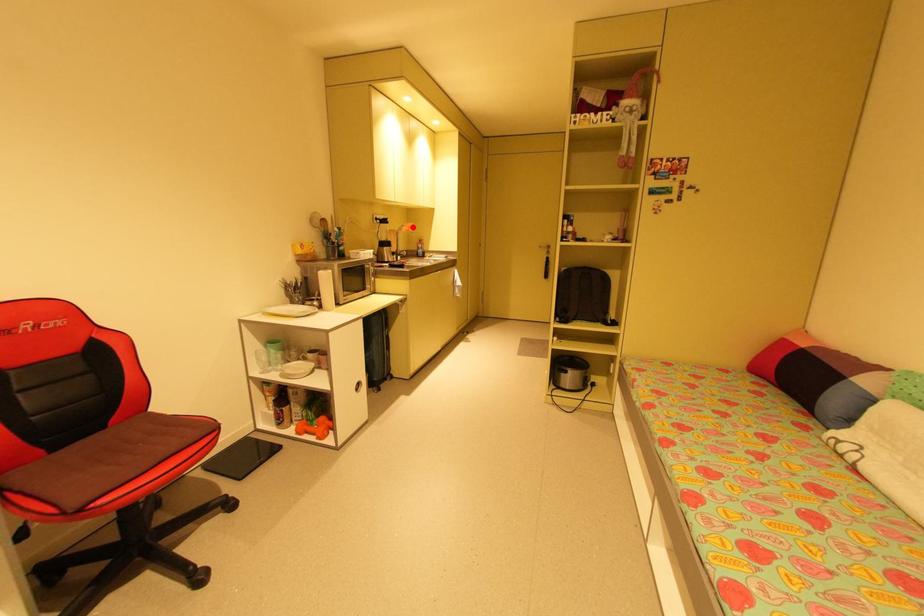
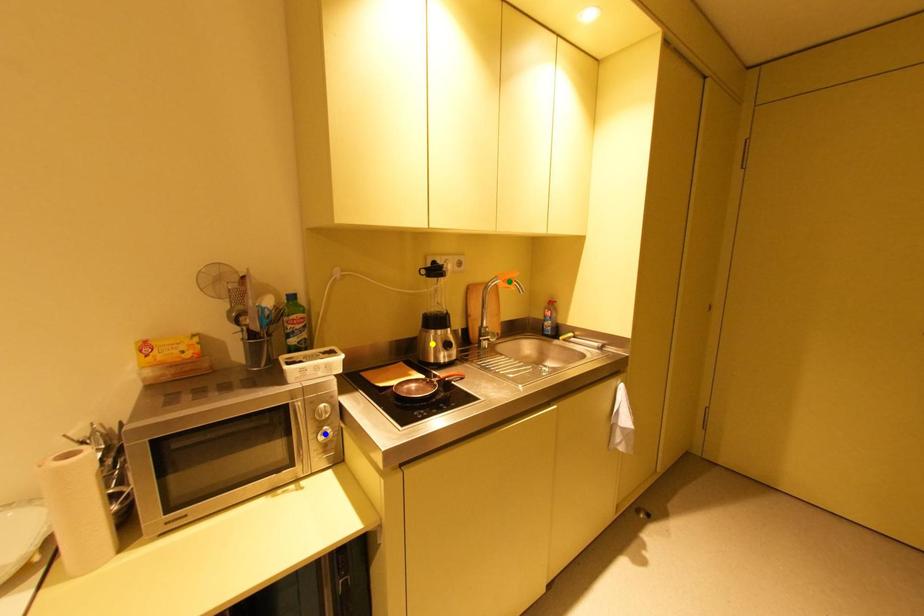
Question: I am providing you with two images of the same scene from different viewpoints. A red point is marked on the first image. You are given multiple points on the second image. Which spot in image 2 lines up with the point in image 1?

Choices:
 (A) green point
 (B) yellow point
 (C) blue point

Answer: (A)